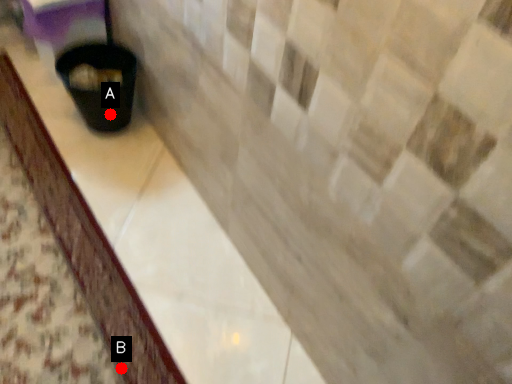
Question: Two points are circled on the image, labeled by A and B beside each circle. Which point is farther from the camera taking this photo?

Choices:
 (A) A is further
 (B) B is further

Answer: (A)